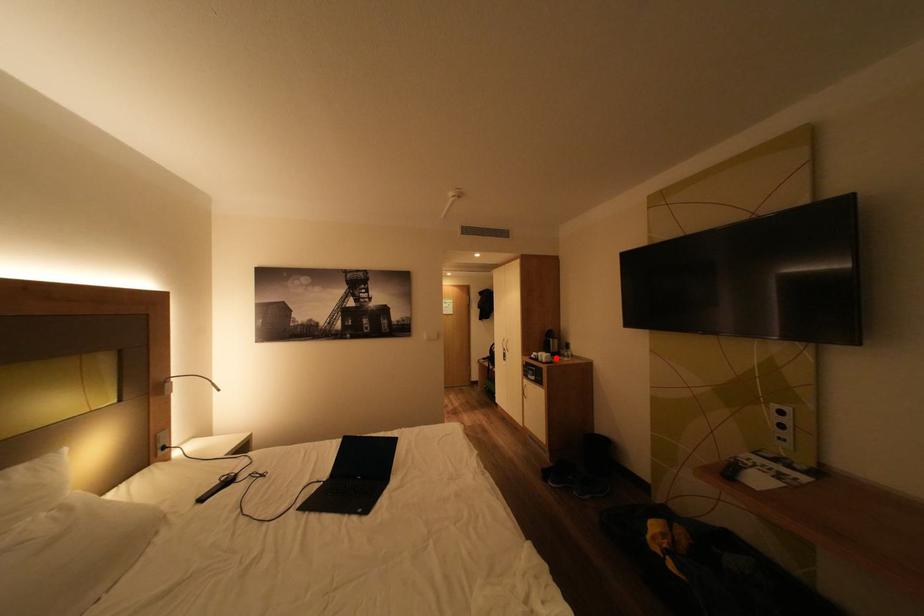
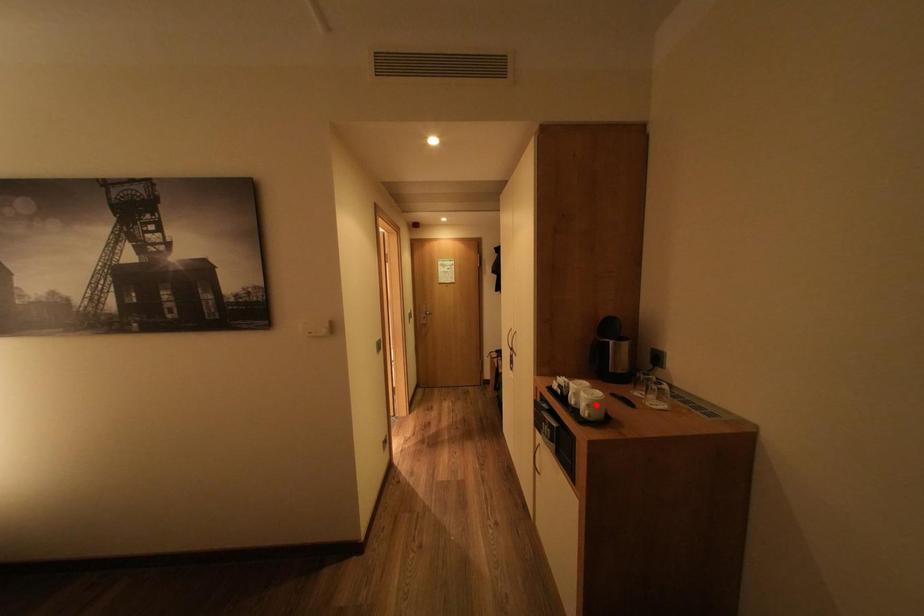
In the scene shown: I am providing you with two images of the same scene from different viewpoints. A red point is marked on the first image and another point is marked on the second image. Is the marked point in image1 the same physical position as the marked point in image2?

No